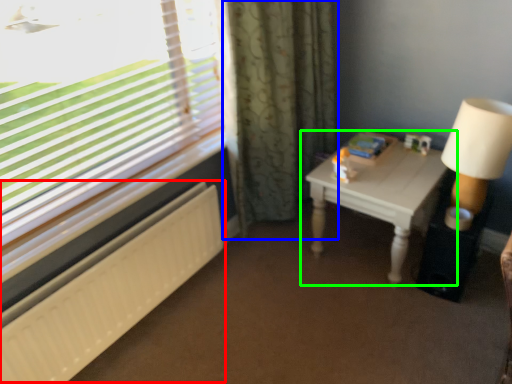
Question: Which is farther away from radiator (highlighted by a red box)? curtain (highlighted by a blue box) or table (highlighted by a green box)?

Choices:
 (A) curtain
 (B) table

Answer: (B)